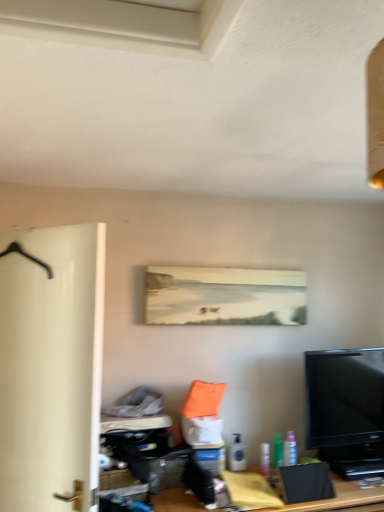
Question: Considering the positions of pink plastic spray bottle at lower right, acting as the 3th toiletry starting from the left, and translucent plastic spray can at lower center, which appears as the first toiletry when viewed from the left, in the image, is pink plastic spray bottle at lower right, acting as the 3th toiletry starting from the left, taller or shorter than translucent plastic spray can at lower center, which appears as the first toiletry when viewed from the left,?

Choices:
 (A) tall
 (B) short

Answer: (A)

Question: From the image's perspective, is pink plastic spray bottle at lower right, acting as the 3th toiletry starting from the left, located above or below translucent plastic spray can at lower center, the third toiletry when ordered from right to left?

Choices:
 (A) above
 (B) below

Answer: (A)

Question: Estimate the real-world distances between objects in this image. Which object is closer to the green plastic bottle at lower right, acting as the second toiletry starting from the left?

Choices:
 (A) matte canvas painting at center
 (B) white matte door at left
 (C) black glossy tv at lower right
 (D) wooden desk at center
 (E) translucent plastic spray can at lower center, which appears as the first toiletry when viewed from the left

Answer: (E)

Question: Estimate the real-world distances between objects in this image. Which object is farther from the green plastic bottle at lower right, the second toiletry positioned from the right?

Choices:
 (A) white matte door at left
 (B) matte canvas painting at center
 (C) wooden desk at center
 (D) translucent plastic spray can at lower center, which appears as the first toiletry when viewed from the left
 (E) black glossy tv at lower right

Answer: (A)